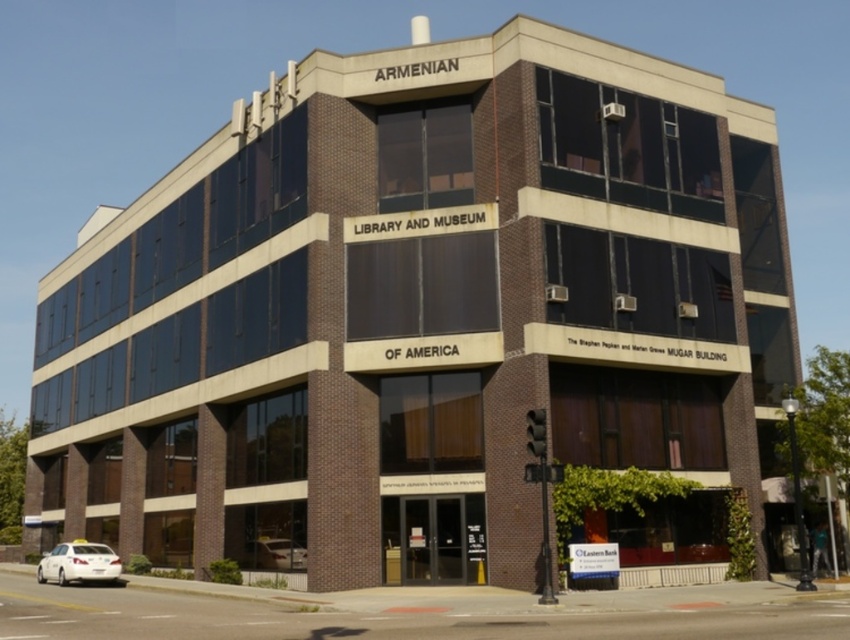
What is the height relationship between the white matte taxi cab at lower left and the white glossy car at lower center in the scene?

The white matte taxi cab at lower left is taller than the white glossy car at lower center.

You are standing at the entrance of the Armenian Library and Museum of America, which is at the top of the building. You need to hail a taxi to go home. Is the white matte taxi cab at lower left located to your left or right side?

The white matte taxi cab at lower left is located to your left side.